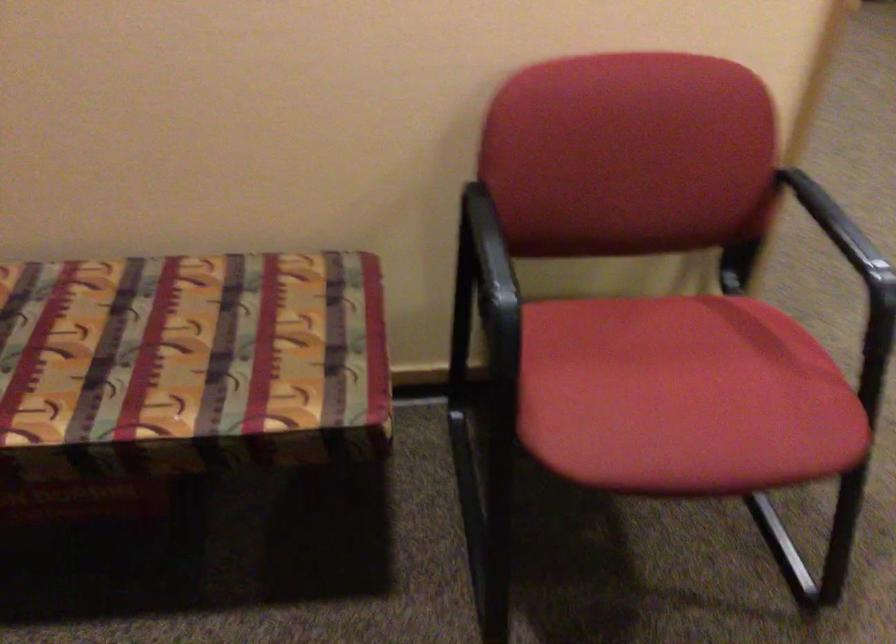
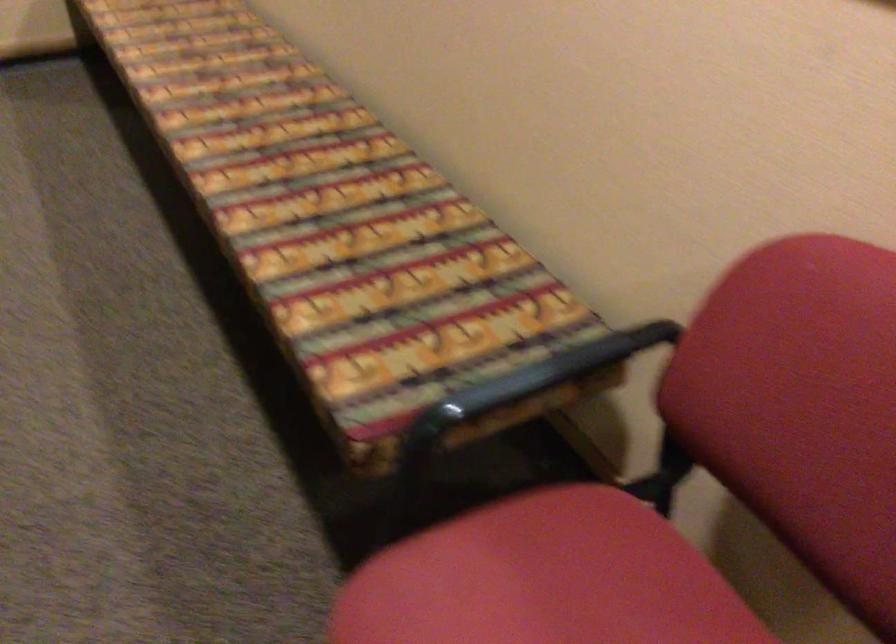
From the picture: Based on the continuous images, in which direction is the camera rotating?

The camera's rotation is toward left-down.